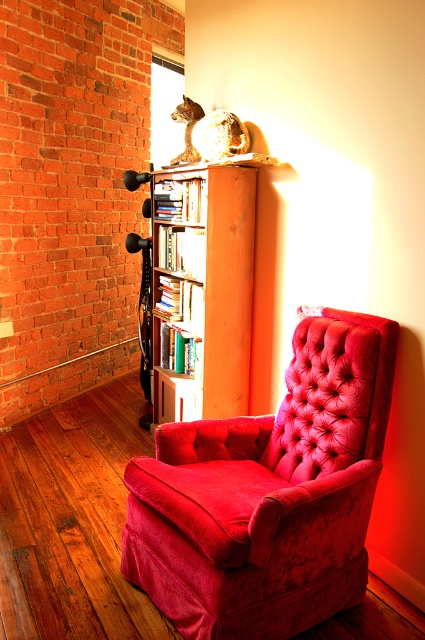
Is velvet red armchair at center smaller than wooden bookshelf at center?

Actually, velvet red armchair at center might be larger than wooden bookshelf at center.

Does point (198, 468) lie in front of point (226, 300)?

Yes, point (198, 468) is closer to viewer.

What are the coordinates of `velvet red armchair at center` in the screenshot? It's located at pyautogui.click(x=269, y=493).